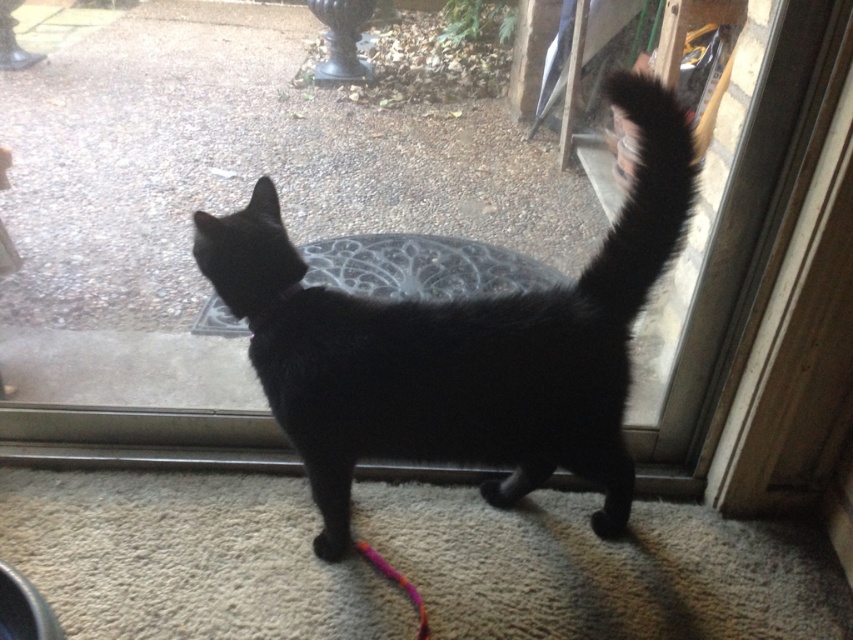
Based on the photo, you are a cat owner who wants to ensure your cat stays safe indoors. Based on the image, where is the black fluffy tail at upper right in relation to the black fur cat at center?

The black fluffy tail at upper right is located above the black fur cat at center.

In the scene shown: You are a delivery person trying to see through the transparent glass window at center at point (218, 212). Can you see the gravel pathway outside the transparent glass window at center?

The transparent glass window at center is located at point (218, 212). Since the window is transparent and partially open, you can see through it to the gravel pathway outside.

You are standing at the entrance of the house and want to place a small potted plant. There are two points marked on the ground where you can place it. The points are labeled as point 1 at coordinates point (479, 152) and point 2 at coordinates point (608, 88). Which point is closer to the entrance?

Point 1 at coordinates point (479, 152) is closer to the entrance than point 2 at coordinates point (608, 88) because point 1 is behind point 2.